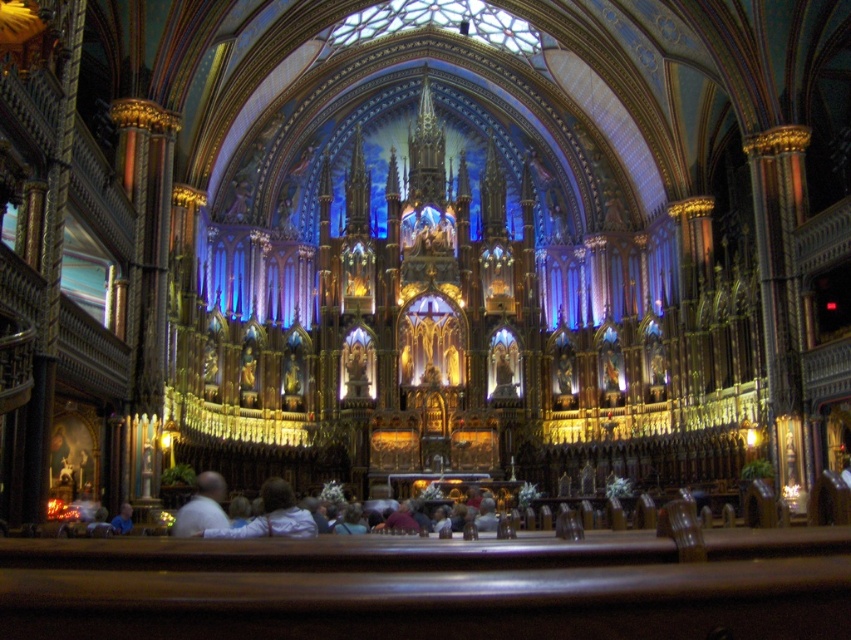
You are a photographer positioned at the entrance of the cathedral. You want to capture a photo that includes both the white matte shirt at lower center and the light blue shirt at lower left. Based on their positions, which shirt should you focus on first to ensure both are in frame?

The white matte shirt at lower center is above the light blue shirt at lower left, so you should focus on the light blue shirt at lower left first to ensure both are in frame.

You are standing in the grand cathedral and want to reach the point marked as point (280,483). Given that the cathedral is 60 meters long, can you walk straight to this point without exceeding the cathedral length?

The distance between you and point (280,483) is 61.30 meters, which exceeds the cathedral length of 60 meters. Therefore, you cannot walk straight to this point without going beyond the cathedral.

You are a photographer positioned at the back of the cathedral. You want to take a photo of the altar and include both the white matte shirt at lower center and the light blue shirt at lower left in the frame. Which shirt should you focus on to ensure both are in the frame without needing to adjust your camera angle?

The white matte shirt at lower center is much taller than the light blue shirt at lower left, so focusing on the white matte shirt at lower center will ensure both shirts are within the frame since it occupies a larger portion of the scene.